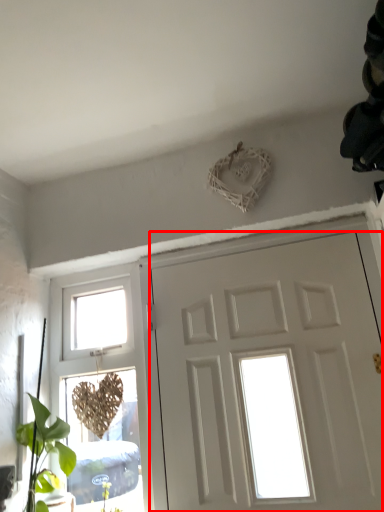
Question: From the image's perspective, considering the relative positions of door (annotated by the red box) and window in the image provided, where is door (annotated by the red box) located with respect to the staircase?

Choices:
 (A) below
 (B) above

Answer: (B)